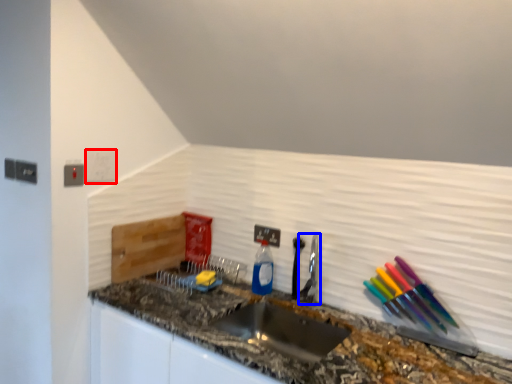
Question: Which object is further to the camera taking this photo, light switch (highlighted by a red box) or faucet (highlighted by a blue box)?

Choices:
 (A) light switch
 (B) faucet

Answer: (A)